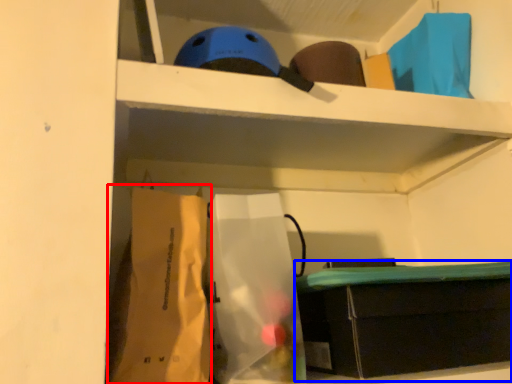
Question: Among these objects, which one is farthest to the camera, paper bag (highlighted by a red box) or furniture (highlighted by a blue box)?

Choices:
 (A) paper bag
 (B) furniture

Answer: (B)